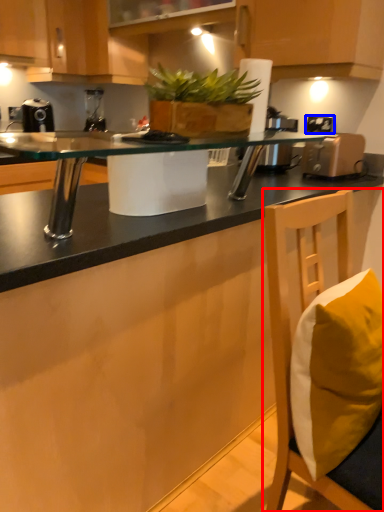
Question: Which point is further to the camera, chair (highlighted by a red box) or electric outlet (highlighted by a blue box)?

Choices:
 (A) chair
 (B) electric outlet

Answer: (B)